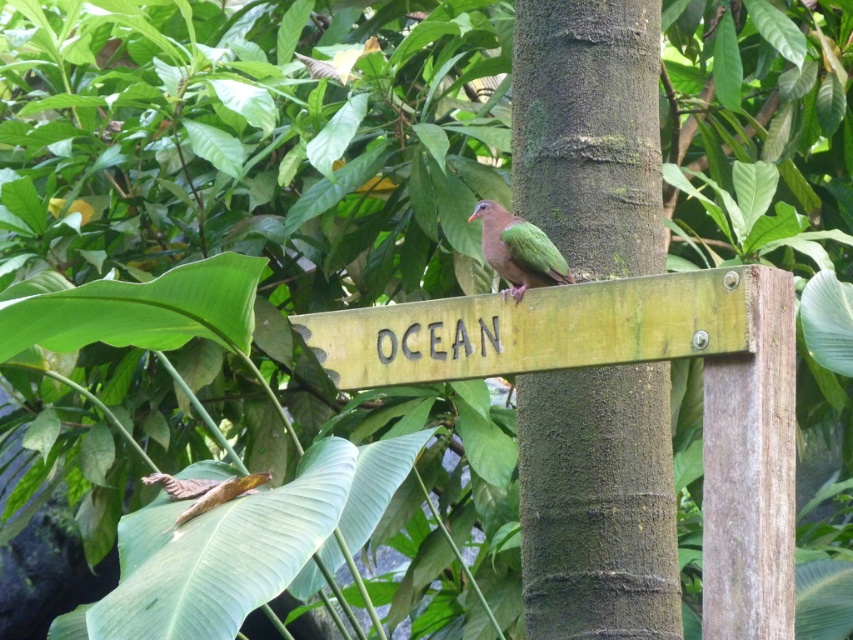
Question: In this image, where is green wood sign at center located relative to green glossy bird at center?

Choices:
 (A) below
 (B) above

Answer: (A)

Question: Which of the following is the farthest from the observer?

Choices:
 (A) (726, 272)
 (B) (543, 250)
 (C) (659, 236)

Answer: (C)

Question: Does green rough bark at center appear over green wood sign at center?

Choices:
 (A) no
 (B) yes

Answer: (B)

Question: Can you confirm if green rough bark at center is positioned to the left of green glossy bird at center?

Choices:
 (A) yes
 (B) no

Answer: (B)

Question: Based on their relative distances, which object is farther from the green glossy bird at center?

Choices:
 (A) green wood sign at center
 (B) green rough bark at center

Answer: (B)

Question: Considering the real-world distances, which object is farthest from the green wood sign at center?

Choices:
 (A) green glossy bird at center
 (B) green rough bark at center

Answer: (B)